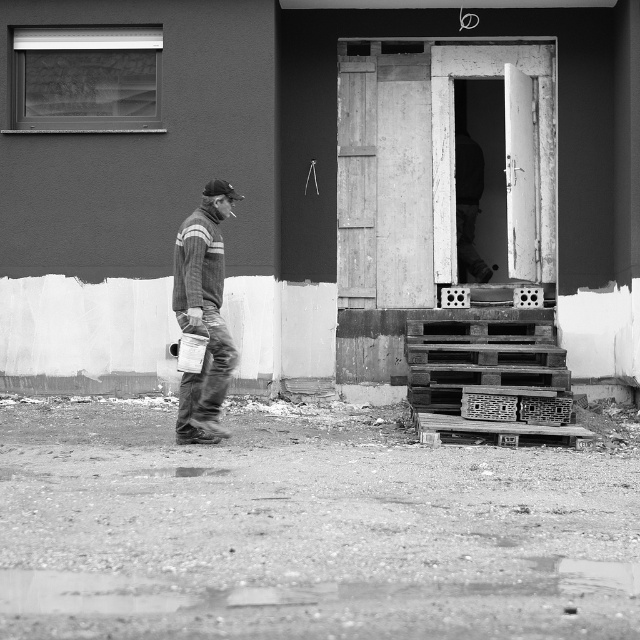
Question: Can you confirm if wooden pallets at lower right is positioned to the left of rustic wooden crate at lower right?

Choices:
 (A) no
 (B) yes

Answer: (A)

Question: Based on their relative distances, which object is nearer to the wooden pallets at lower right?

Choices:
 (A) striped fleece jacket at left
 (B) wooden crate at lower right

Answer: (B)

Question: Which object appears farthest from the camera in this image?

Choices:
 (A) wooden pallets at lower right
 (B) striped fleece jacket at left

Answer: (A)

Question: Considering the relative positions of striped fleece jacket at left and wooden crate at lower right in the image provided, where is striped fleece jacket at left located with respect to wooden crate at lower right?

Choices:
 (A) left
 (B) right

Answer: (A)

Question: Is striped fleece jacket at left wider than rustic wooden crate at lower right?

Choices:
 (A) yes
 (B) no

Answer: (A)

Question: Which of the following is the closest to the observer?

Choices:
 (A) wooden pallets at lower right
 (B) wooden crate at lower right
 (C) striped fleece jacket at left
 (D) rustic wooden crate at lower right

Answer: (C)